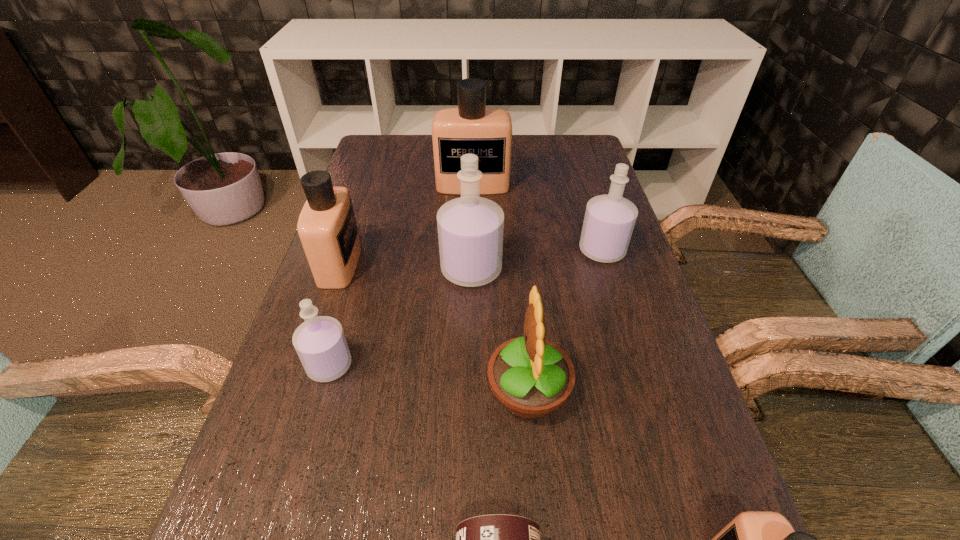
This screenshot has height=540, width=960. What are the coordinates of `free spot located 0.100m on the front of the biggest purple perfume` in the screenshot? It's located at (470, 325).

What are the coordinates of `vacant space located 0.160m on the front of the second smallest purple perfume` in the screenshot? It's located at (622, 316).

I want to click on vacant region located on the front label of the leftmost beige perfume, so [523, 264].

Identify the location of free space located on the face of the sunflower. This screenshot has width=960, height=540. (277, 390).

Find the location of a particular element. vacant position located 0.110m on the face of the sunflower is located at coordinates (428, 390).

The height and width of the screenshot is (540, 960). In order to click on free spot located 0.090m on the face of the sunflower in this screenshot , I will do `click(439, 390)`.

Identify the location of free space located 0.210m on the front of the smallest purple perfume. This screenshot has height=540, width=960. (289, 503).

The height and width of the screenshot is (540, 960). Find the location of `object that is at the right edge`. object that is at the right edge is located at coordinates (609, 220).

You are a GUI agent. You are given a task and a screenshot of the screen. Output one action in this format:
    pyautogui.click(x=<x>, y=<y>)
    Task: Click on the free space at the far edge
    Image resolution: width=960 pixels, height=540 pixels.
    Given the screenshot: What is the action you would take?
    [x=528, y=151]

Find the location of a particular element. The image size is (960, 540). free spot at the left edge of the desktop is located at coordinates (346, 323).